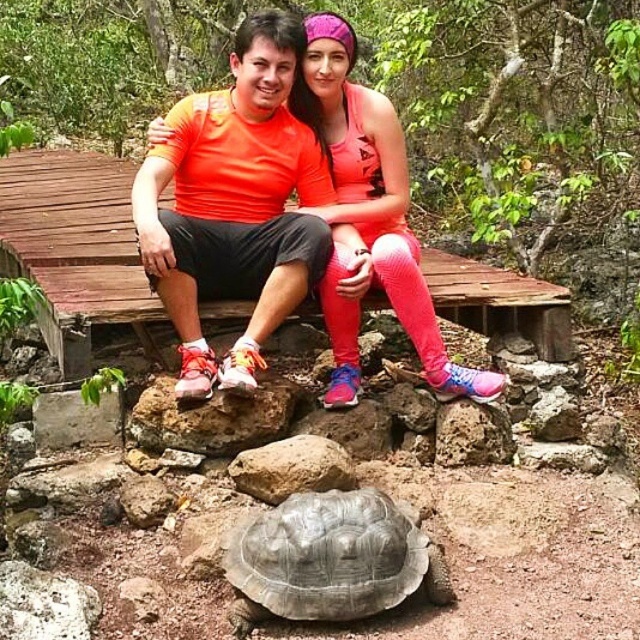
Consider the image. Does orange matte shirt at center appear over gray textured tortoise at lower center?

Indeed, orange matte shirt at center is positioned over gray textured tortoise at lower center.

The image size is (640, 640). Identify the location of orange matte shirt at center. (380, 198).